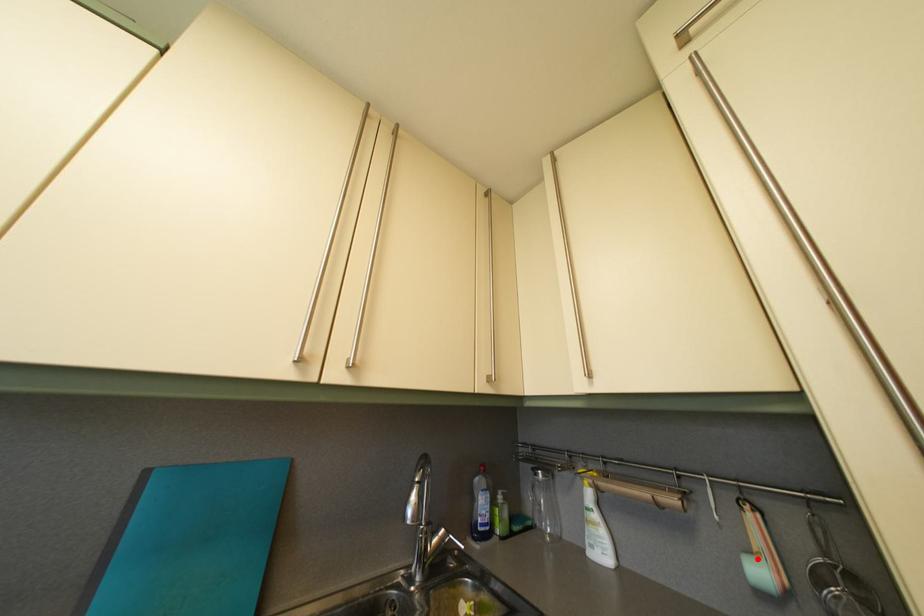
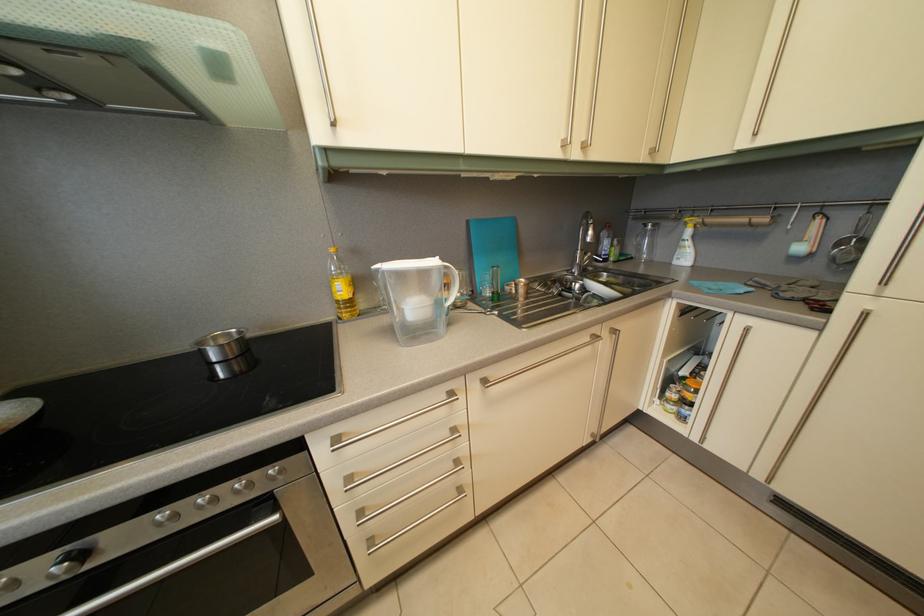
Question: I am providing you with two images of the same scene from different viewpoints. Given a red point in image1, look at the same physical point in image2. Is it:

Choices:
 (A) Closer to the viewpoint
 (B) Farther from the viewpoint

Answer: (B)